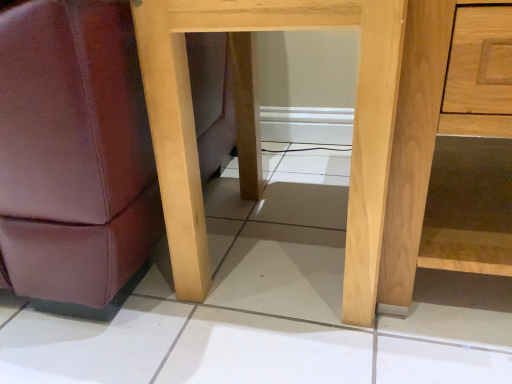
Question: From the image's perspective, is natural wood table at center under light brown wood dresser at right?

Choices:
 (A) yes
 (B) no

Answer: (A)

Question: Is natural wood table at center thinner than light brown wood dresser at right?

Choices:
 (A) no
 (B) yes

Answer: (B)

Question: Does natural wood table at center contain light brown wood dresser at right?

Choices:
 (A) yes
 (B) no

Answer: (B)

Question: Can you confirm if natural wood table at center is bigger than light brown wood dresser at right?

Choices:
 (A) no
 (B) yes

Answer: (A)

Question: Does natural wood table at center come behind light brown wood dresser at right?

Choices:
 (A) yes
 (B) no

Answer: (A)

Question: Is natural wood table at center at the right side of light brown wood dresser at right?

Choices:
 (A) no
 (B) yes

Answer: (A)

Question: Is light brown wood dresser at right positioned behind natural wood table at center?

Choices:
 (A) no
 (B) yes

Answer: (A)

Question: Considering the relative sizes of light brown wood dresser at right and natural wood table at center in the image provided, is light brown wood dresser at right bigger than natural wood table at center?

Choices:
 (A) no
 (B) yes

Answer: (B)

Question: From a real-world perspective, is light brown wood dresser at right located higher than natural wood table at center?

Choices:
 (A) yes
 (B) no

Answer: (B)

Question: Can you confirm if light brown wood dresser at right is smaller than natural wood table at center?

Choices:
 (A) yes
 (B) no

Answer: (B)

Question: Considering the relative sizes of light brown wood dresser at right and natural wood table at center in the image provided, is light brown wood dresser at right thinner than natural wood table at center?

Choices:
 (A) yes
 (B) no

Answer: (B)

Question: Are light brown wood dresser at right and natural wood table at center far apart?

Choices:
 (A) yes
 (B) no

Answer: (B)

Question: From a real-world perspective, relative to light brown wood dresser at right, is natural wood table at center vertically above or below?

Choices:
 (A) above
 (B) below

Answer: (A)